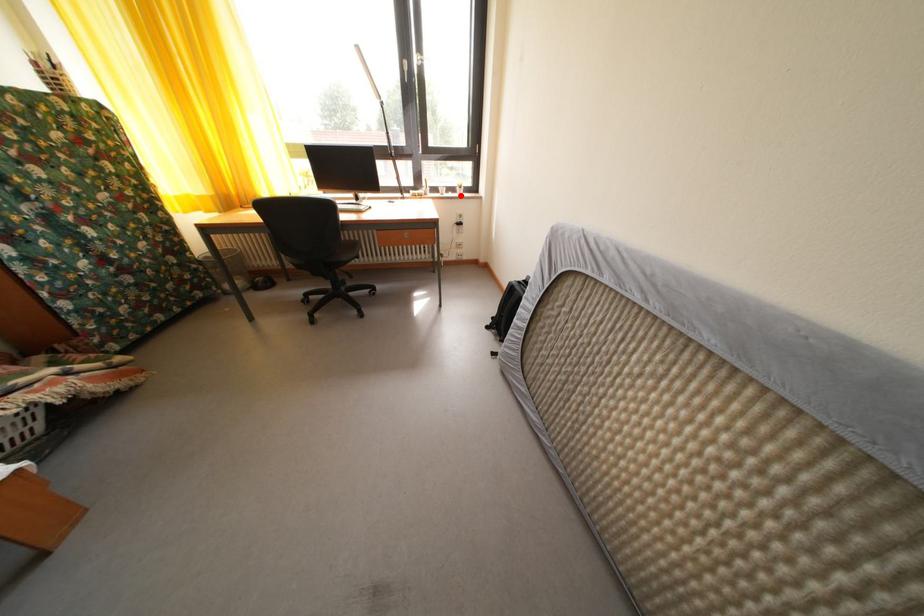
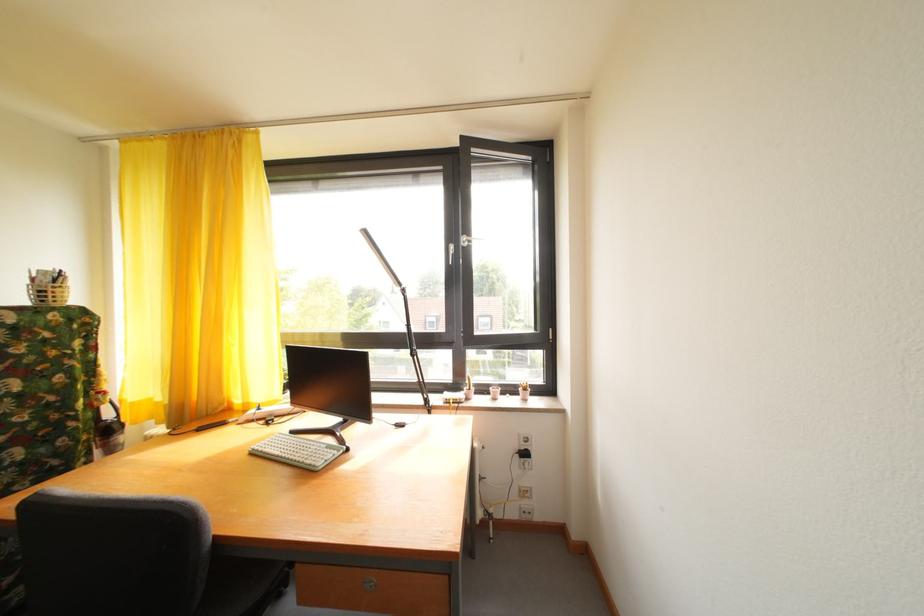
Find the pixel in the second image that matches the highlighted location in the first image.

(520, 395)